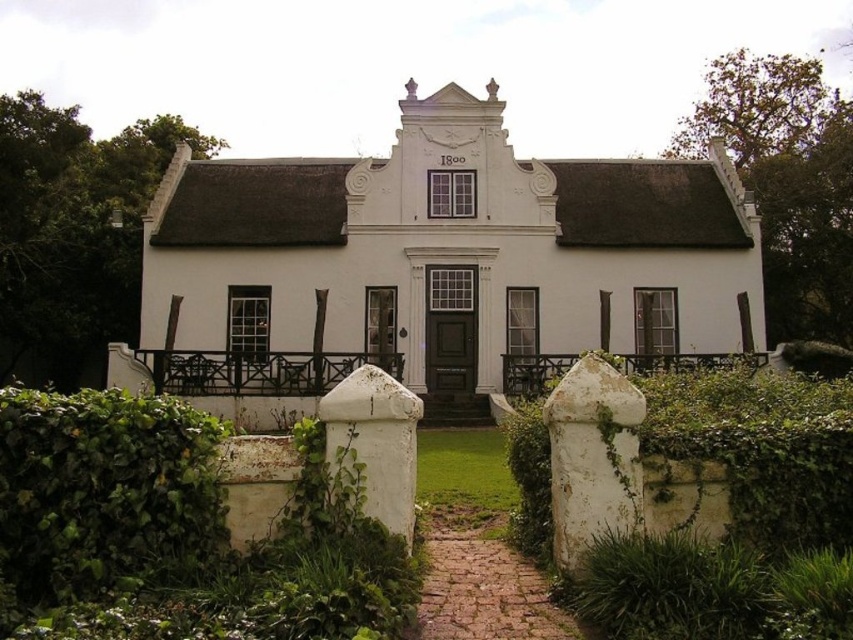
You are standing in front of the Dutch colonial house and want to take a photo. There are two points marked on the lawn, one at point coordinates point (x=85, y=424) and the other at point coordinates point (x=469, y=566). Which point will appear closer to the camera in your photo?

Point (x=85, y=424) is closer to the camera than point (x=469, y=566), so it will appear closer in the photo.